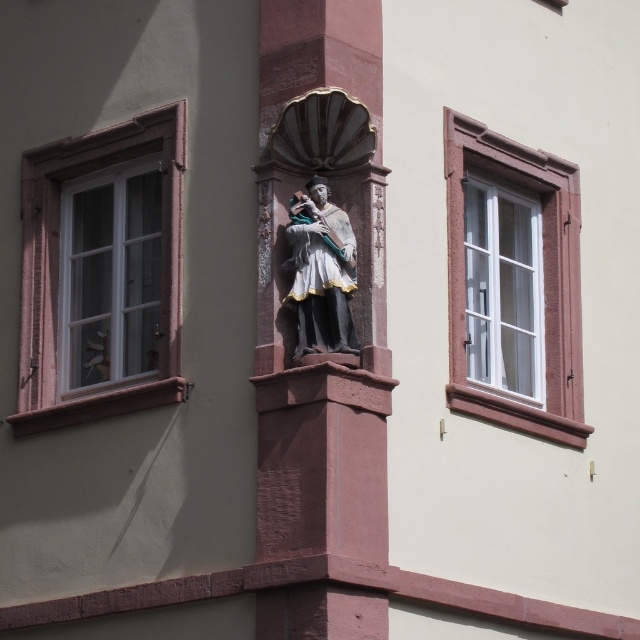
Does white glass window at right have a lesser height compared to polished bronze statue at center?

In fact, white glass window at right may be taller than polished bronze statue at center.

Does white glass window at right appear under polished bronze statue at center?

Yes.

This screenshot has width=640, height=640. What do you see at coordinates (544, 280) in the screenshot?
I see `white glass window at right` at bounding box center [544, 280].

At what (x,y) coordinates should I click in order to perform the action: click on white glass window at right. Please return your answer as a coordinate pair (x, y). This screenshot has width=640, height=640. Looking at the image, I should click on (544, 280).

Between white wood window at left and white glass window at right, which one has more height?

white glass window at right

Can you confirm if white wood window at left is wider than white glass window at right?

Yes, white wood window at left is wider than white glass window at right.

Is point (164, 294) closer to camera compared to point (577, 442)?

That is True.

The width and height of the screenshot is (640, 640). I want to click on white wood window at left, so click(58, 266).

Between white wood window at left and polished bronze statue at center, which one appears on the right side from the viewer's perspective?

polished bronze statue at center

This screenshot has height=640, width=640. I want to click on white wood window at left, so click(x=58, y=266).

Identify the location of white wood window at left. The image size is (640, 640). tap(58, 266).